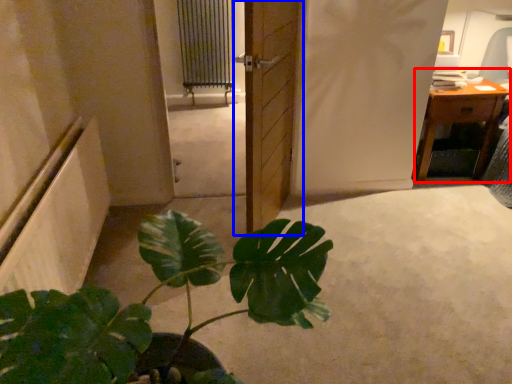
Question: Which object is closer to the camera taking this photo, table (highlighted by a red box) or door (highlighted by a blue box)?

Choices:
 (A) table
 (B) door

Answer: (B)